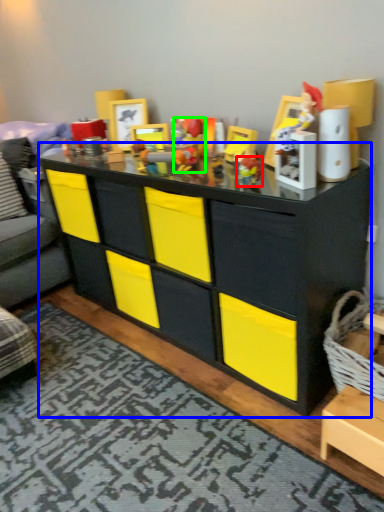
Question: Based on their relative distances, which object is farther from toy (highlighted by a red box)? Choose from chest of drawers (highlighted by a blue box) and toy (highlighted by a green box).

Choices:
 (A) chest of drawers
 (B) toy

Answer: (A)